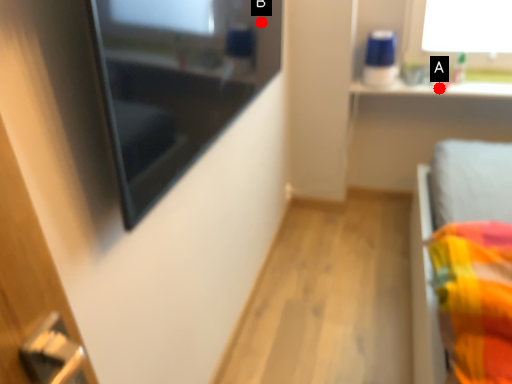
Question: Two points are circled on the image, labeled by A and B beside each circle. Which point is farther to the camera?

Choices:
 (A) A is further
 (B) B is further

Answer: (A)